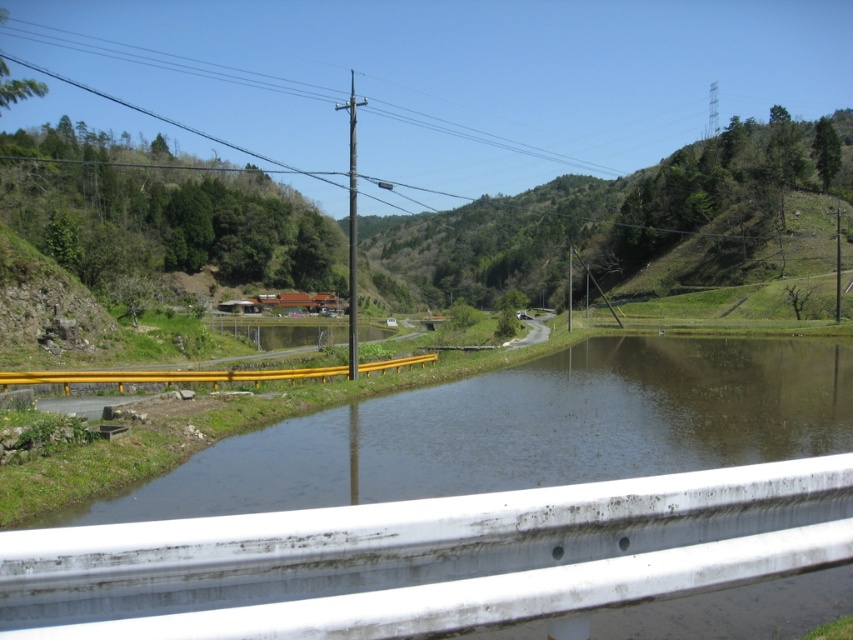
Can you confirm if clear water at lower left is positioned below green grassy hillside at center?

Yes.

Can you confirm if clear water at lower left is shorter than green grassy hillside at center?

Yes.

Does point (618, 406) come behind point (805, 250)?

That is False.

This screenshot has height=640, width=853. I want to click on clear water at lower left, so click(525, 429).